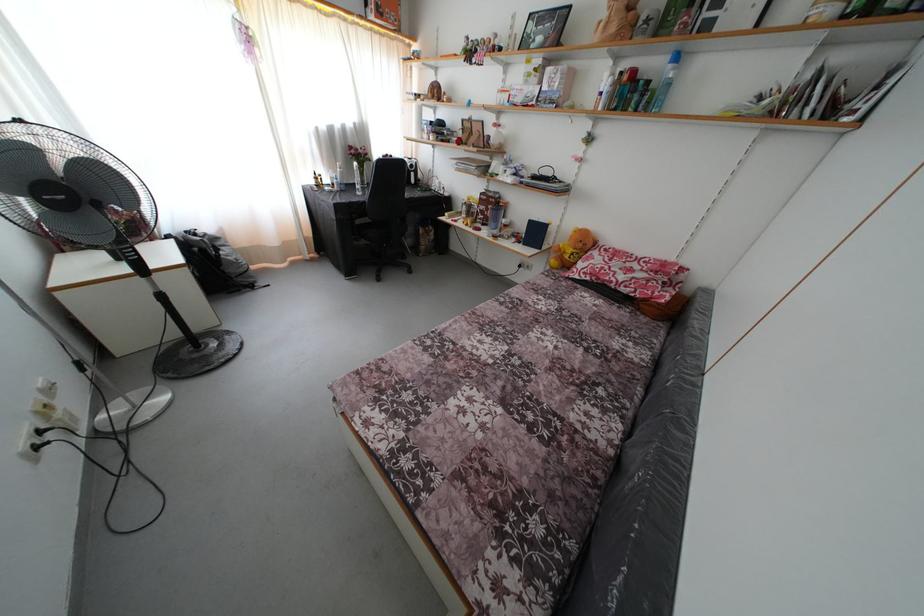
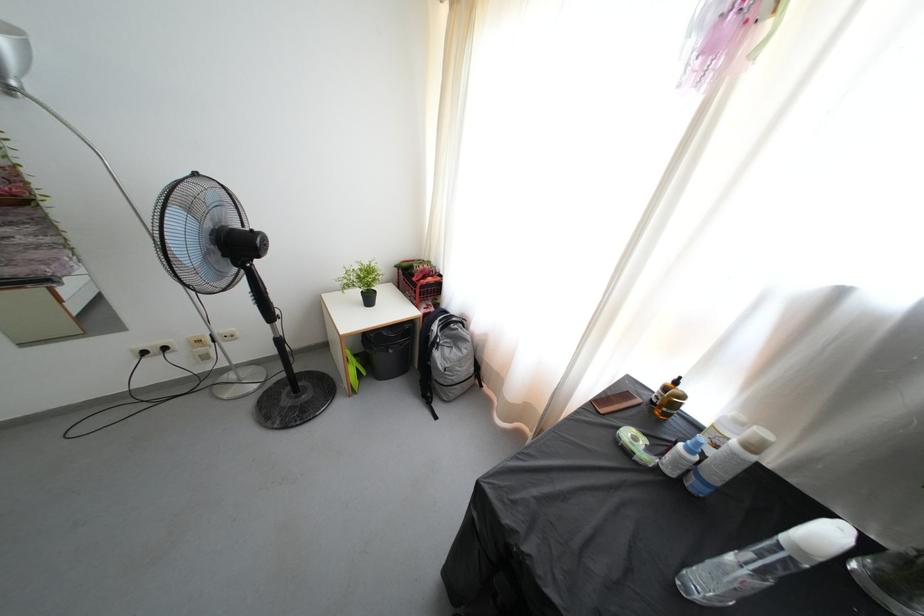
Locate, in the second image, the point that corresponds to (247,276) in the first image.

(445, 387)